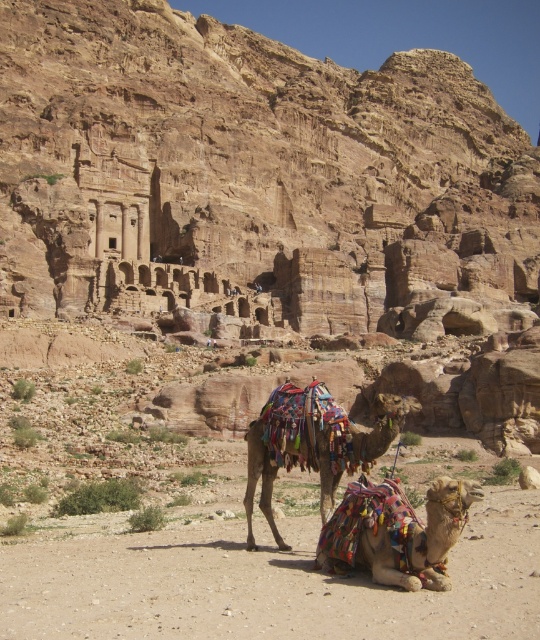
You are a tourist standing at the entrance of Petra and want to take a photo of the multicolored fabric camel at lower center. According to the coordinates provided, where should you position yourself to capture it in the frame?

To capture the multicolored fabric camel at lower center in your photo, position yourself so that the camel is centered at the coordinates approximately 0.833 on the horizontal axis and 0.735 on the vertical axis of the image frame.

You are a tourist standing at the entrance of Petra, looking towards the iconic rock structures. You see two camels with multicolored fabric saddles. Which camel, the multicolored fabric camel at lower center or the multicolored fabric camel at center, is positioned closer to your right side?

The multicolored fabric camel at lower center is positioned to the right of the multicolored fabric camel at center, so from your perspective as a tourist facing the rock structures, the multicolored fabric camel at lower center is closer to your right side.